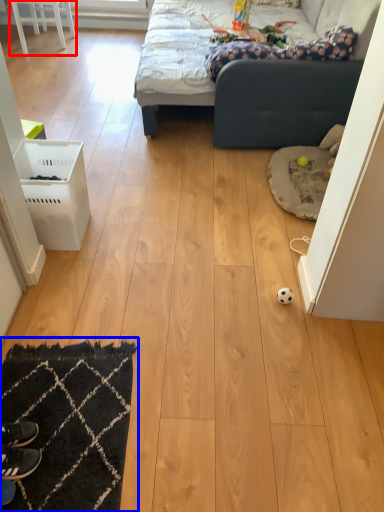
Question: Which point is further to the camera, furniture (highlighted by a red box) or mat (highlighted by a blue box)?

Choices:
 (A) furniture
 (B) mat

Answer: (A)